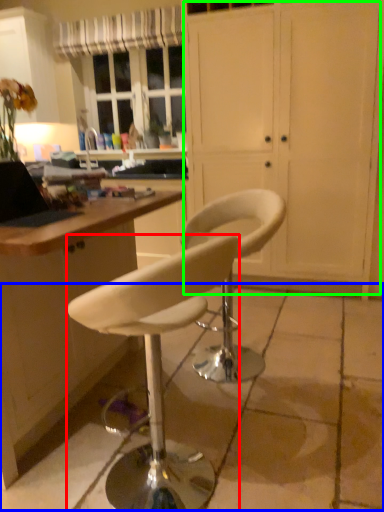
Question: Which object is the farthest from chair (highlighted by a red box)? Choose among these: concrete (highlighted by a blue box) or screen door (highlighted by a green box).

Choices:
 (A) concrete
 (B) screen door

Answer: (B)